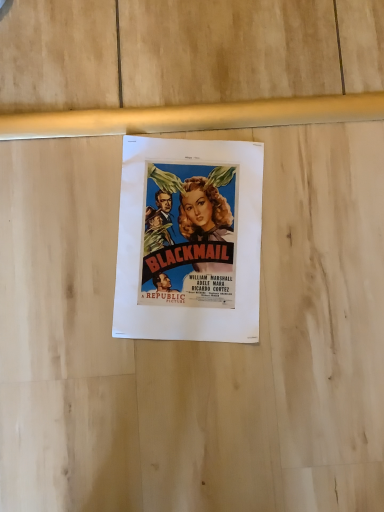
What is the approximate width of matte paper poster at center?

It is 11.86 inches.

Locate an element on the screen. matte paper poster at center is located at coordinates (189, 240).

What do you see at coordinates (189, 240) in the screenshot? I see `matte paper poster at center` at bounding box center [189, 240].

Identify the location of matte paper poster at center. The width and height of the screenshot is (384, 512). (189, 240).